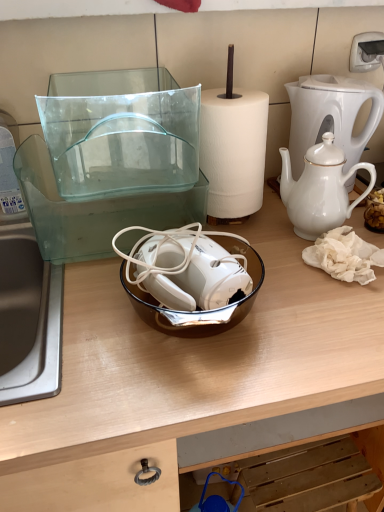
Question: Is transparent glass bowl at center placed right next to brown glass bowl at center?

Choices:
 (A) yes
 (B) no

Answer: (B)

Question: Does transparent glass bowl at center have a larger size compared to brown glass bowl at center?

Choices:
 (A) no
 (B) yes

Answer: (B)

Question: Can you confirm if transparent glass bowl at center is smaller than brown glass bowl at center?

Choices:
 (A) no
 (B) yes

Answer: (A)

Question: Is transparent glass bowl at center positioned with its back to brown glass bowl at center?

Choices:
 (A) yes
 (B) no

Answer: (B)

Question: Can you confirm if transparent glass bowl at center is wider than brown glass bowl at center?

Choices:
 (A) yes
 (B) no

Answer: (A)

Question: Would you say white glossy coffee maker at upper right is inside or outside silver metallic sink at left?

Choices:
 (A) outside
 (B) inside

Answer: (A)

Question: Does point (362, 80) appear closer or farther from the camera than point (54, 297)?

Choices:
 (A) farther
 (B) closer

Answer: (A)

Question: From a real-world perspective, relative to silver metallic sink at left, is white glossy coffee maker at upper right vertically above or below?

Choices:
 (A) below
 (B) above

Answer: (B)

Question: In terms of width, does white glossy coffee maker at upper right look wider or thinner when compared to silver metallic sink at left?

Choices:
 (A) thin
 (B) wide

Answer: (A)

Question: In terms of width, does transparent glass bowl at center look wider or thinner when compared to white porcelain teapot at right?

Choices:
 (A) wide
 (B) thin

Answer: (A)

Question: From a real-world perspective, relative to white porcelain teapot at right, is transparent glass bowl at center vertically above or below?

Choices:
 (A) above
 (B) below

Answer: (B)

Question: From the image's perspective, relative to white porcelain teapot at right, is transparent glass bowl at center above or below?

Choices:
 (A) above
 (B) below

Answer: (B)

Question: In terms of height, does transparent glass bowl at center look taller or shorter compared to white porcelain teapot at right?

Choices:
 (A) tall
 (B) short

Answer: (A)

Question: From a real-world perspective, relative to transparent glass bowl at center, is silver metallic sink at left vertically above or below?

Choices:
 (A) above
 (B) below

Answer: (A)

Question: From the image's perspective, relative to transparent glass bowl at center, is silver metallic sink at left above or below?

Choices:
 (A) above
 (B) below

Answer: (A)